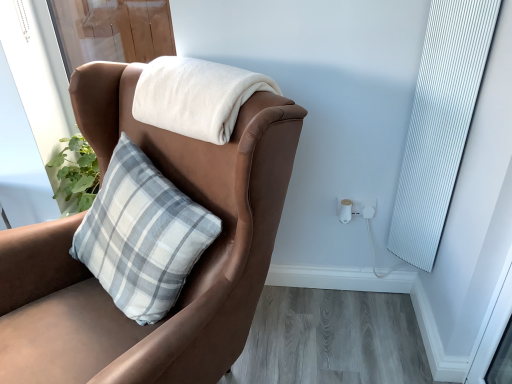
Question: Is brown leather chair at upper left completely or partially inside white soft blanket at upper center?

Choices:
 (A) yes
 (B) no

Answer: (B)

Question: From a real-world perspective, is white soft blanket at upper center positioned over brown leather chair at upper left based on gravity?

Choices:
 (A) yes
 (B) no

Answer: (A)

Question: Is white soft blanket at upper center far from brown leather chair at upper left?

Choices:
 (A) no
 (B) yes

Answer: (A)

Question: Is white soft blanket at upper center next to brown leather chair at upper left and touching it?

Choices:
 (A) no
 (B) yes

Answer: (A)

Question: Is white soft blanket at upper center bigger than brown leather chair at upper left?

Choices:
 (A) yes
 (B) no

Answer: (B)

Question: Could you tell me if white soft blanket at upper center is facing brown leather chair at upper left?

Choices:
 (A) no
 (B) yes

Answer: (B)

Question: Is white ribbed curtain at right at the left side of white soft blanket at upper center?

Choices:
 (A) no
 (B) yes

Answer: (A)

Question: From a real-world perspective, is white ribbed curtain at right physically below white soft blanket at upper center?

Choices:
 (A) no
 (B) yes

Answer: (B)

Question: Is white ribbed curtain at right next to white soft blanket at upper center and touching it?

Choices:
 (A) no
 (B) yes

Answer: (A)

Question: Can you confirm if white ribbed curtain at right is thinner than white soft blanket at upper center?

Choices:
 (A) yes
 (B) no

Answer: (A)

Question: From a real-world perspective, is white ribbed curtain at right over white soft blanket at upper center?

Choices:
 (A) yes
 (B) no

Answer: (B)

Question: Does white ribbed curtain at right have a lesser height compared to white soft blanket at upper center?

Choices:
 (A) no
 (B) yes

Answer: (A)

Question: Considering the relative sizes of white soft blanket at upper center and white plastic electric outlet at lower right in the image provided, is white soft blanket at upper center smaller than white plastic electric outlet at lower right?

Choices:
 (A) yes
 (B) no

Answer: (B)